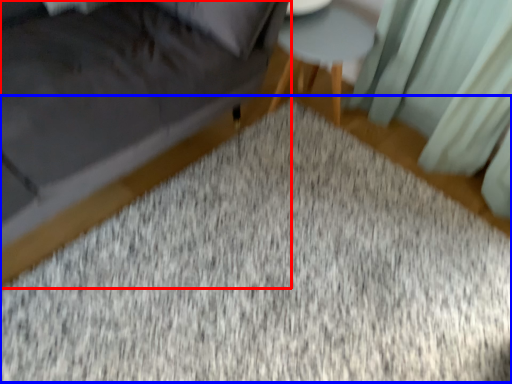
Question: Among these objects, which one is farthest to the camera, furniture (highlighted by a red box) or mat (highlighted by a blue box)?

Choices:
 (A) furniture
 (B) mat

Answer: (B)